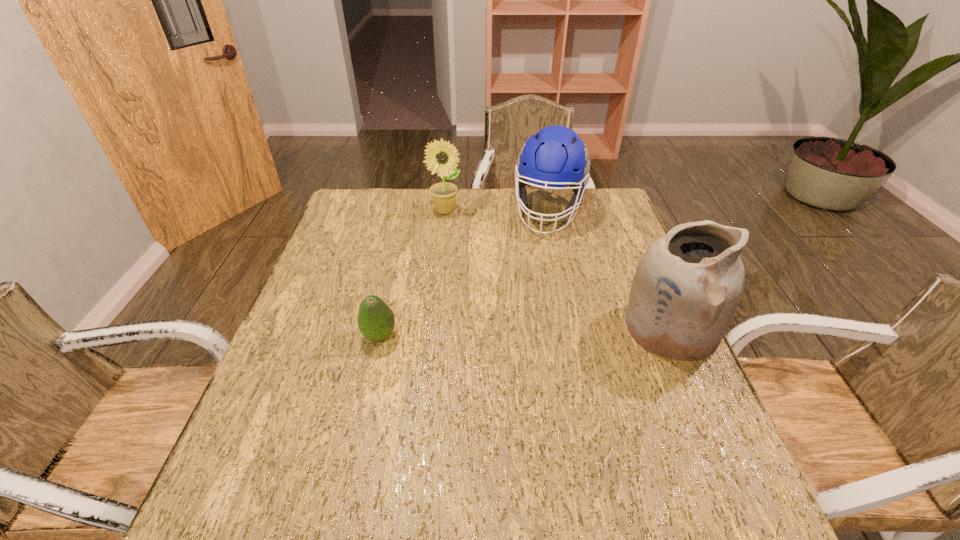
Locate an element on the screen. The height and width of the screenshot is (540, 960). free spot between the shortest object and the pottery is located at coordinates (525, 332).

Where is `empty space that is in between the rightmost object and the second object from right to left`? empty space that is in between the rightmost object and the second object from right to left is located at coordinates (610, 269).

I want to click on free space between the rightmost object and the avocado, so click(x=525, y=332).

Where is `object identified as the third closest to the avocado`? Image resolution: width=960 pixels, height=540 pixels. object identified as the third closest to the avocado is located at coordinates 686,289.

Identify the location of object that stands as the second closest to the avocado. (555, 157).

Find the location of a particular element. This screenshot has width=960, height=540. vacant space that satisfies the following two spatial constraints: 1. on the back side of the second object from left to right; 2. on the left side of the shortest object is located at coordinates (x=408, y=211).

The image size is (960, 540). I want to click on vacant space that satisfies the following two spatial constraints: 1. on the back side of the leftmost object; 2. on the left side of the third object from left to right, so click(x=408, y=211).